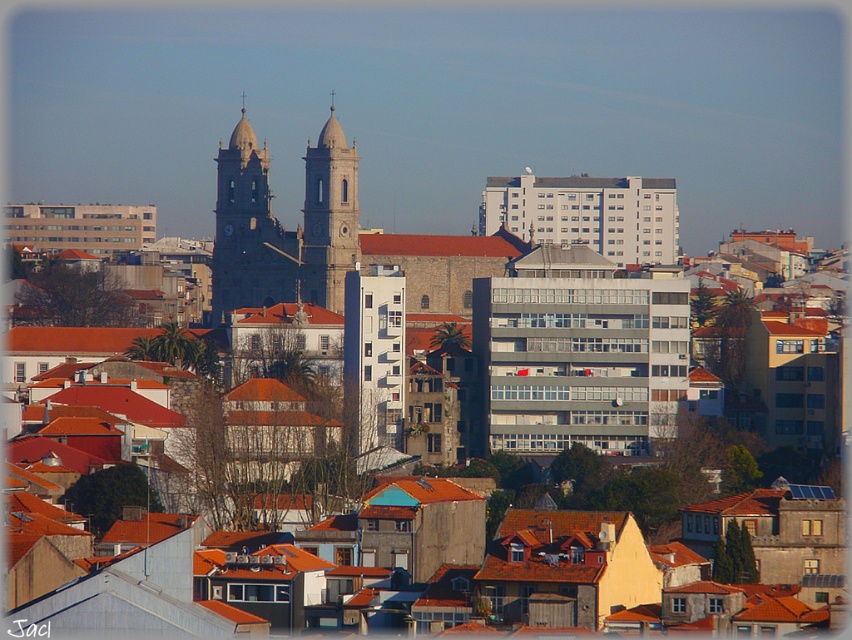
What do you see at coordinates (248, 230) in the screenshot?
I see `dark gray stone tower at center` at bounding box center [248, 230].

Is dark gray stone tower at center shorter than light beige stone tower at center?

No.

Who is more distant from viewer, (251, 147) or (314, 266)?

Point (251, 147)

Image resolution: width=852 pixels, height=640 pixels. Identify the location of dark gray stone tower at center. (248, 230).